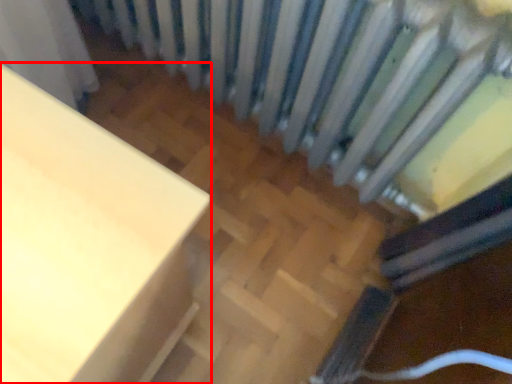
Question: From the image's perspective, where is furniture (annotated by the red box) located relative to radiator?

Choices:
 (A) below
 (B) above

Answer: (A)